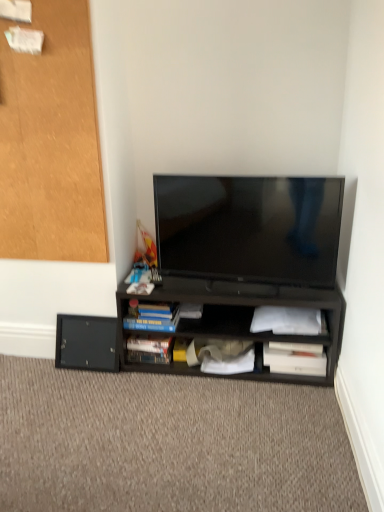
Identify the location of free space in front of hardcover book at lower center, which ranks as the 4th paperback book in right-to-left order. The height and width of the screenshot is (512, 384). (145, 380).